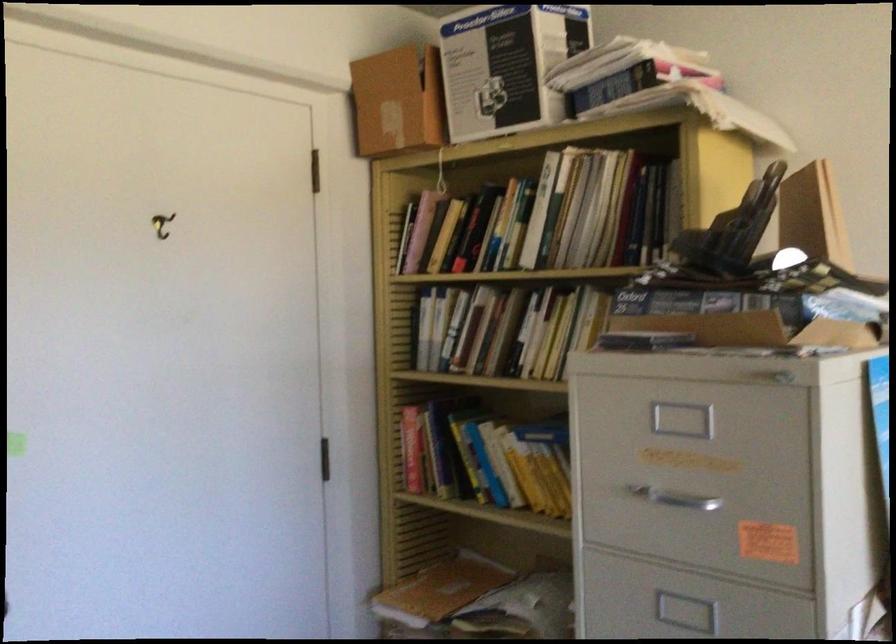
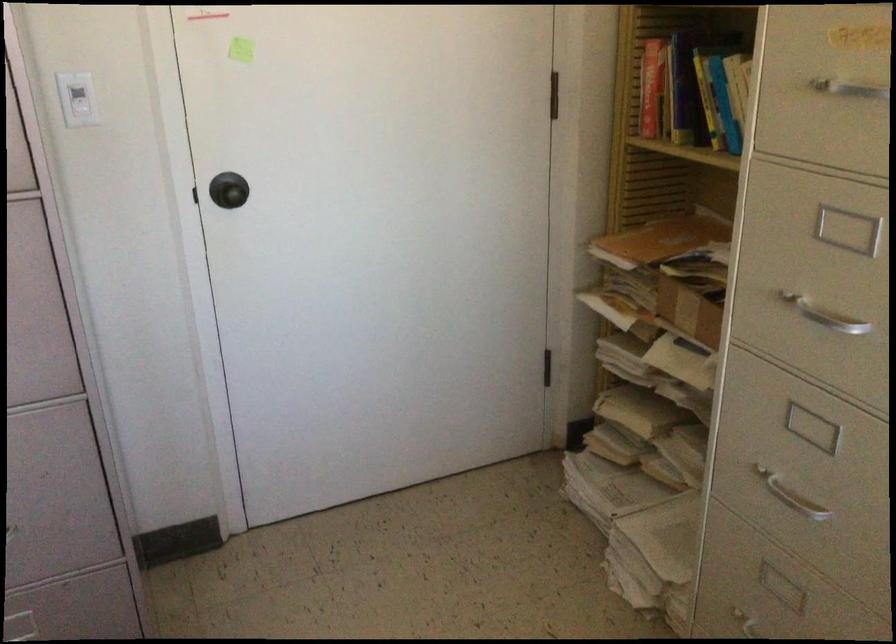
Locate, in the second image, the point that corresponds to [414,451] in the first image.

(650, 88)